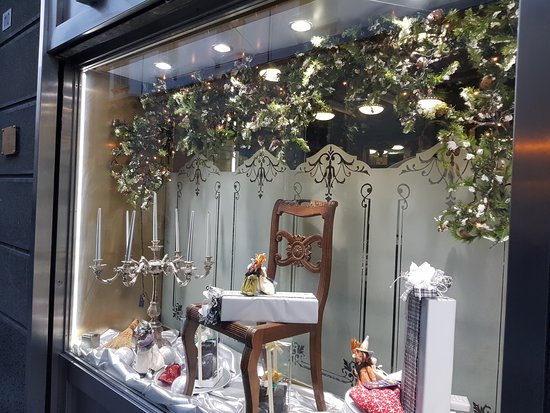
Locate an element on the screen. candle is located at coordinates (103, 240), (124, 219), (133, 238), (154, 220), (173, 233), (188, 228), (210, 238).